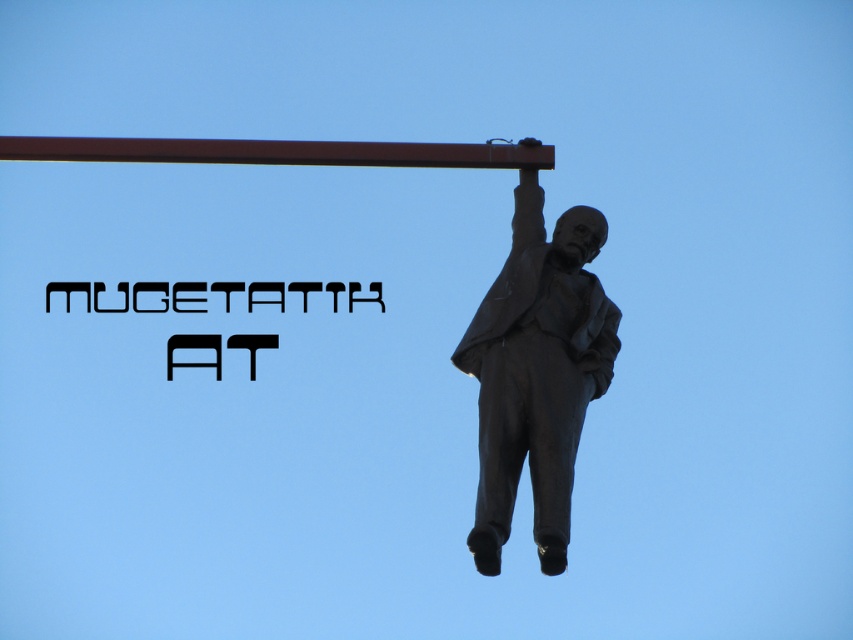
You are a painter standing 10 meters away from the bronze statue at upper right. You want to paint the brown metal pole at upper center. Can you reach the pole with your 12 meter long paintbrush without moving closer?

The bronze statue at upper right and brown metal pole at upper center are 11.34 meters apart from each other. Since you are 10 meters away from the statue, the pole is 1.34 meters away from you. Your paintbrush is 12 meters long, which is longer than the 1.34 meters distance. Therefore, you can reach the pole with your paintbrush without moving closer.

You are an art installer planning to move the bronze statue at upper right and the brown metal pole at upper center to a new exhibition space. The new space has a height restriction of 2 meters. Can both objects be moved without any modifications?

The bronze statue at upper right is larger in size than the brown metal pole at upper center, but the exact dimensions of each object are not provided. Without knowing their specific heights, it is impossible to determine if they can be moved under the 2 meter height restriction.